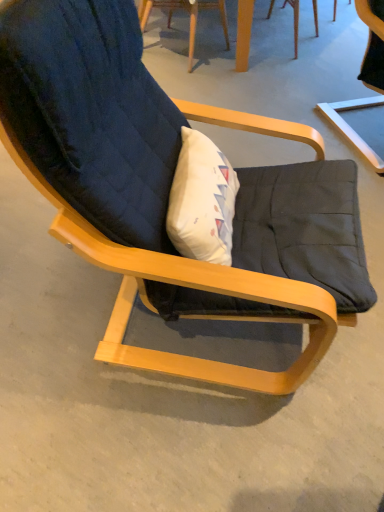
Locate an element on the screen. matte black cushion at center, which ranks as the second chair in left-to-right order is located at coordinates (364, 80).

From the image's perspective, relative to matte black cushion at center, which is counted as the 1th chair, starting from the right, is dark blue fabric chair at upper center, placed as the first chair when sorted from left to right, above or below?

dark blue fabric chair at upper center, placed as the first chair when sorted from left to right, is situated higher than matte black cushion at center, which is counted as the 1th chair, starting from the right, in the image.

Who is smaller, dark blue fabric chair at upper center, placed as the first chair when sorted from left to right, or matte black cushion at center, which ranks as the second chair in left-to-right order?

Smaller between the two is dark blue fabric chair at upper center, placed as the first chair when sorted from left to right.

Between dark blue fabric chair at upper center, placed as the first chair when sorted from left to right, and matte black cushion at center, which is counted as the 1th chair, starting from the right, which one is positioned in front?

matte black cushion at center, which is counted as the 1th chair, starting from the right.

Looking at this image, considering the sizes of objects matte black cushion at center, which ranks as the second chair in left-to-right order, and dark blue fabric chair at upper center, the second chair when ordered from right to left, in the image provided, who is shorter, matte black cushion at center, which ranks as the second chair in left-to-right order, or dark blue fabric chair at upper center, the second chair when ordered from right to left,?

dark blue fabric chair at upper center, the second chair when ordered from right to left.

Does point (328, 105) lie behind point (144, 26)?

That is False.

Which object is closer to the camera, matte black cushion at center, which is counted as the 1th chair, starting from the right, or dark blue fabric chair at upper center, the second chair when ordered from right to left?

Positioned in front is matte black cushion at center, which is counted as the 1th chair, starting from the right.

Locate an element on the screen. This screenshot has height=512, width=384. chair on the right side of wooden table at upper center is located at coordinates (364, 80).

Is wooden table at upper center oriented towards matte black cushion at center, which ranks as the second chair in left-to-right order?

No, wooden table at upper center is not turned towards matte black cushion at center, which ranks as the second chair in left-to-right order.

Considering the positions of point (207, 3) and point (380, 37), is point (207, 3) closer or farther from the camera than point (380, 37)?

Point (207, 3) appears to be farther away from the viewer than point (380, 37).

Between wooden table at upper center and matte black cushion at center, which ranks as the second chair in left-to-right order, which one has larger width?

matte black cushion at center, which ranks as the second chair in left-to-right order.

Considering the relative sizes of dark blue fabric chair at upper center, placed as the first chair when sorted from left to right, and wooden table at upper center in the image provided, is dark blue fabric chair at upper center, placed as the first chair when sorted from left to right, bigger than wooden table at upper center?

Correct, dark blue fabric chair at upper center, placed as the first chair when sorted from left to right, is larger in size than wooden table at upper center.

Relative to wooden table at upper center, is dark blue fabric chair at upper center, the second chair when ordered from right to left, in front or behind?

In the image, dark blue fabric chair at upper center, the second chair when ordered from right to left, appears in front of wooden table at upper center.

Between dark blue fabric chair at upper center, the second chair when ordered from right to left, and wooden table at upper center, which one has smaller width?

wooden table at upper center.

Does point (182, 6) come behind point (247, 54)?

Yes.

Is wooden table at upper center spatially inside dark blue fabric chair at upper center, the second chair when ordered from right to left, or outside of it?

wooden table at upper center cannot be found inside dark blue fabric chair at upper center, the second chair when ordered from right to left.

Is wooden table at upper center far from dark blue fabric chair at upper center, placed as the first chair when sorted from left to right?

No, wooden table at upper center is not far away from dark blue fabric chair at upper center, placed as the first chair when sorted from left to right.

Considering the positions of objects wooden table at upper center and dark blue fabric chair at upper center, placed as the first chair when sorted from left to right, in the image provided, who is more to the left, wooden table at upper center or dark blue fabric chair at upper center, placed as the first chair when sorted from left to right,?

dark blue fabric chair at upper center, placed as the first chair when sorted from left to right, is more to the left.

The image size is (384, 512). Identify the location of table located above the matte black cushion at center, which is counted as the 1th chair, starting from the right (from the image's perspective). (171, 16).

Considering the positions of objects matte black cushion at center, which is counted as the 1th chair, starting from the right, and wooden table at upper center in the image provided, who is behind, matte black cushion at center, which is counted as the 1th chair, starting from the right, or wooden table at upper center?

Positioned behind is wooden table at upper center.

Considering the points (369, 70) and (246, 58), which point is in front, point (369, 70) or point (246, 58)?

The point (369, 70) is closer.

Consider the image. Does matte black cushion at center, which is counted as the 1th chair, starting from the right, have a lesser height compared to wooden table at upper center?

A: No, matte black cushion at center, which is counted as the 1th chair, starting from the right, is not shorter than wooden table at upper center.

This screenshot has width=384, height=512. In order to click on chair below the matte black cushion at center, which is counted as the 1th chair, starting from the right (from a real-world perspective) in this screenshot , I will do `click(189, 16)`.

Find the location of `chair below the dark blue fabric chair at upper center, the second chair when ordered from right to left (from the image's perspective)`. chair below the dark blue fabric chair at upper center, the second chair when ordered from right to left (from the image's perspective) is located at coordinates (364, 80).

Based on their spatial positions, is wooden table at upper center or matte black cushion at center, which ranks as the second chair in left-to-right order, further from dark blue fabric chair at upper center, placed as the first chair when sorted from left to right?

matte black cushion at center, which ranks as the second chair in left-to-right order, is further to dark blue fabric chair at upper center, placed as the first chair when sorted from left to right.

When comparing their distances from matte black cushion at center, which is counted as the 1th chair, starting from the right, does wooden table at upper center or dark blue fabric chair at upper center, placed as the first chair when sorted from left to right, seem closer?

wooden table at upper center.

Considering their positions, is matte black cushion at center, which is counted as the 1th chair, starting from the right, positioned further to wooden table at upper center than dark blue fabric chair at upper center, the second chair when ordered from right to left?

The object further to wooden table at upper center is matte black cushion at center, which is counted as the 1th chair, starting from the right.

Based on their spatial positions, is dark blue fabric chair at upper center, the second chair when ordered from right to left, or matte black cushion at center, which is counted as the 1th chair, starting from the right, further from wooden table at upper center?

matte black cushion at center, which is counted as the 1th chair, starting from the right, is further to wooden table at upper center.

Consider the image. When comparing their distances from dark blue fabric chair at upper center, the second chair when ordered from right to left, does matte black cushion at center, which is counted as the 1th chair, starting from the right, or wooden table at upper center seem further?

matte black cushion at center, which is counted as the 1th chair, starting from the right.

When comparing their distances from matte black cushion at center, which ranks as the second chair in left-to-right order, does dark blue fabric chair at upper center, the second chair when ordered from right to left, or wooden table at upper center seem closer?

wooden table at upper center is positioned closer to the anchor matte black cushion at center, which ranks as the second chair in left-to-right order.

The height and width of the screenshot is (512, 384). In order to click on table between dark blue fabric chair at upper center, the second chair when ordered from right to left, and matte black cushion at center, which ranks as the second chair in left-to-right order, in the horizontal direction in this screenshot , I will do `click(171, 16)`.